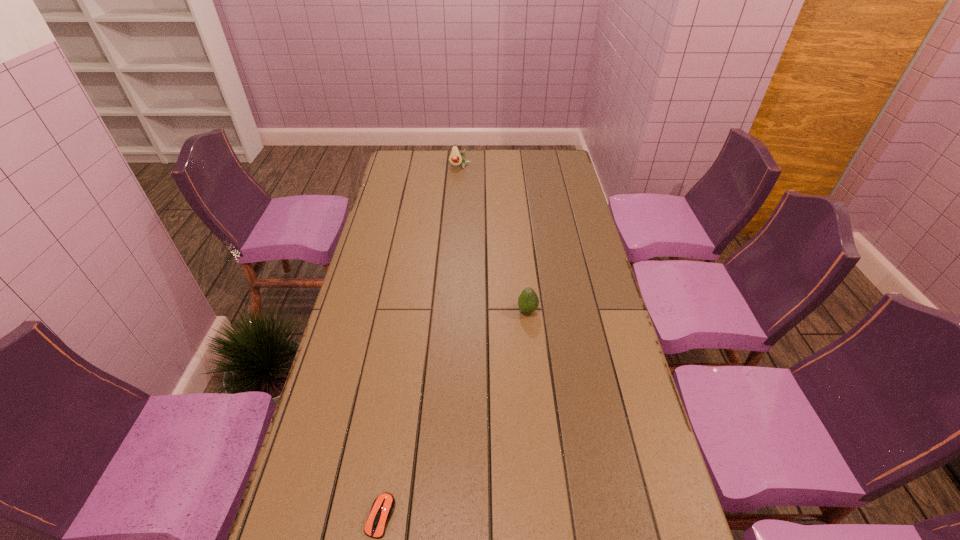
Locate an element on the screen. This screenshot has height=540, width=960. free spot between the shortest object and the farthest object is located at coordinates (420, 341).

Find the location of a particular element. free point between the farther avocado and the nearest object is located at coordinates (420, 341).

Identify the location of free space that is in between the shortest object and the rightmost object. (454, 414).

Where is `the closest object to the computer mouse`? The height and width of the screenshot is (540, 960). the closest object to the computer mouse is located at coordinates (528, 301).

Locate which object ranks in proximity to the farthest object. Please provide its 2D coordinates. Your answer should be formatted as a tuple, i.e. [(x, y)], where the tuple contains the x and y coordinates of a point satisfying the conditions above.

[(528, 301)]

Where is `vacant area that satisfies the following two spatial constraints: 1. on the seed side of the farther avocado; 2. on the left side of the nearer avocado`? The width and height of the screenshot is (960, 540). vacant area that satisfies the following two spatial constraints: 1. on the seed side of the farther avocado; 2. on the left side of the nearer avocado is located at coordinates (450, 311).

I want to click on free space that satisfies the following two spatial constraints: 1. on the back side of the nearest object; 2. on the right side of the right avocado, so click(412, 311).